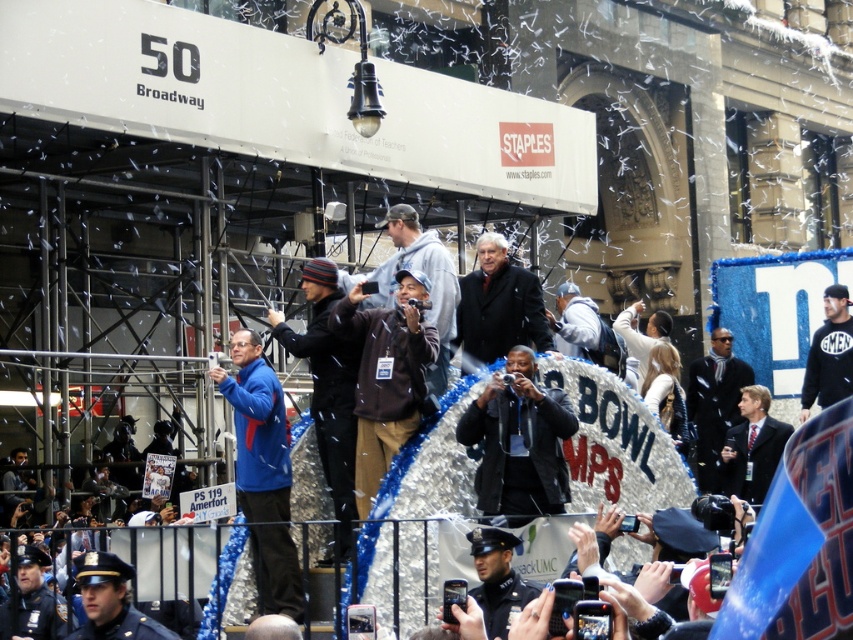
You are a photographer at the event and need to choose between two subjects. The dark gray hoodie at center and the dark suit at center. Which subject would be easier to capture from a distance due to their size?

The dark gray hoodie at center is larger in size than the dark suit at center, so it would be easier to capture from a distance.

You are organizing a photo shoot and need to place two models wearing the dark brown wool coat at center and the dark blue uniform at center side by side. Based on the scene description, which model should stand on the left to ensure both fit within a 1.5 meter wide frame?

The dark brown wool coat at center is wider than the dark blue uniform at center. To fit both within the 1.5 meter frame, the wider dark brown wool coat at center should be placed on the left, and the narrower dark blue uniform at center on the right.